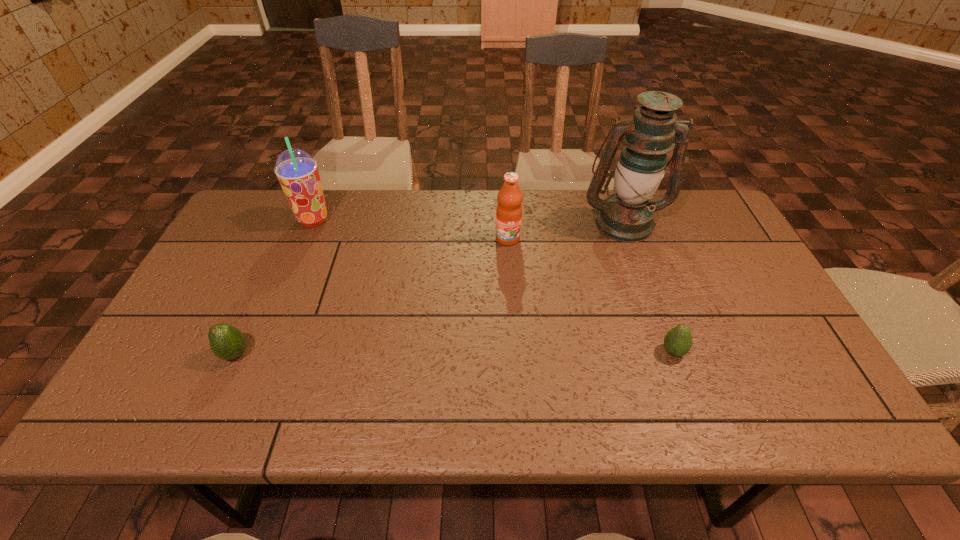
Find the location of a particular element. Image resolution: width=960 pixels, height=540 pixels. object that is the third nearest to the right avocado is located at coordinates (226, 342).

Point out which object is positioned as the second nearest to the smoothie. Please provide its 2D coordinates. Your answer should be formatted as a tuple, i.e. [(x, y)], where the tuple contains the x and y coordinates of a point satisfying the conditions above.

[(509, 209)]

Locate an element on the screen. The height and width of the screenshot is (540, 960). vacant region that satisfies the following two spatial constraints: 1. on the front label of the fruit juice; 2. on the right side of the right avocado is located at coordinates (516, 352).